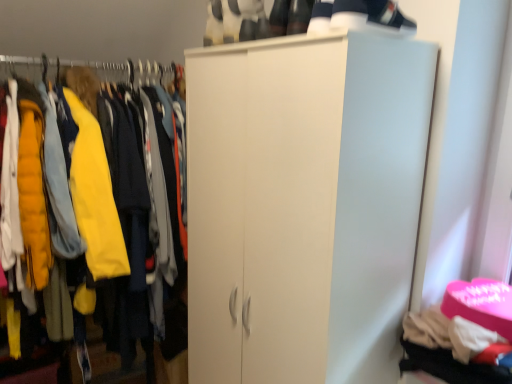
Where is `white matte cabinet at center`? The height and width of the screenshot is (384, 512). white matte cabinet at center is located at coordinates (101, 78).

The image size is (512, 384). What do you see at coordinates (101, 78) in the screenshot?
I see `white matte cabinet at center` at bounding box center [101, 78].

The image size is (512, 384). What are the coordinates of `white matte cabinet at center` in the screenshot? It's located at (101, 78).